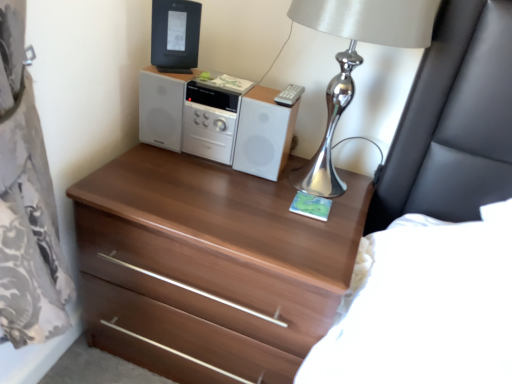
Find the location of a particular element. The width and height of the screenshot is (512, 384). free space in front of black plastic desktop computer at upper center is located at coordinates (172, 79).